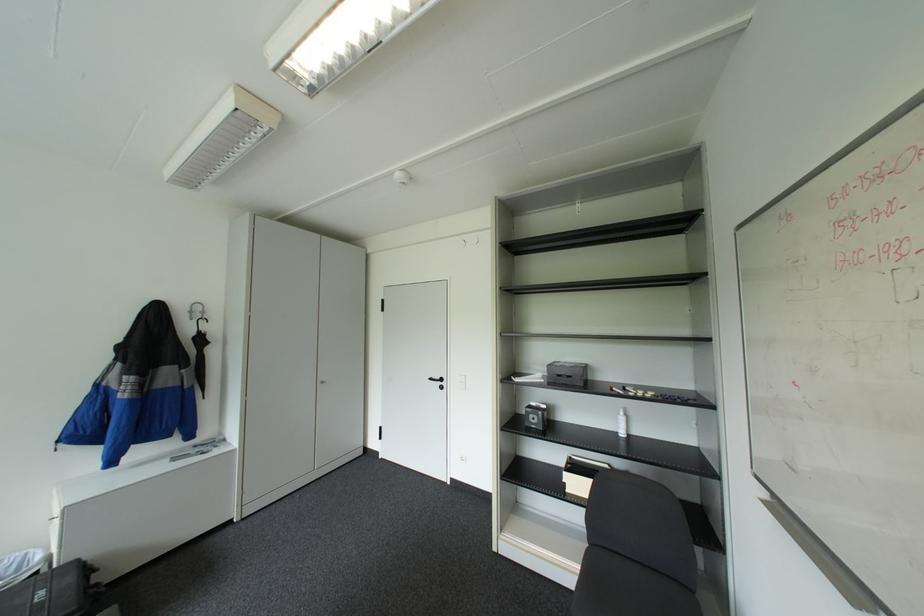
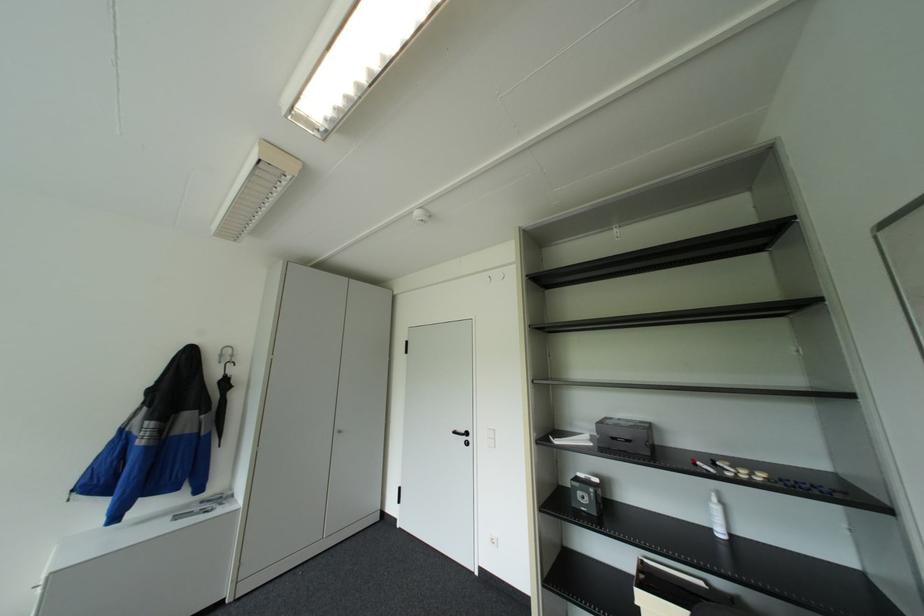
Find the pixel in the second image that matches (551,379) in the first image.

(600, 443)